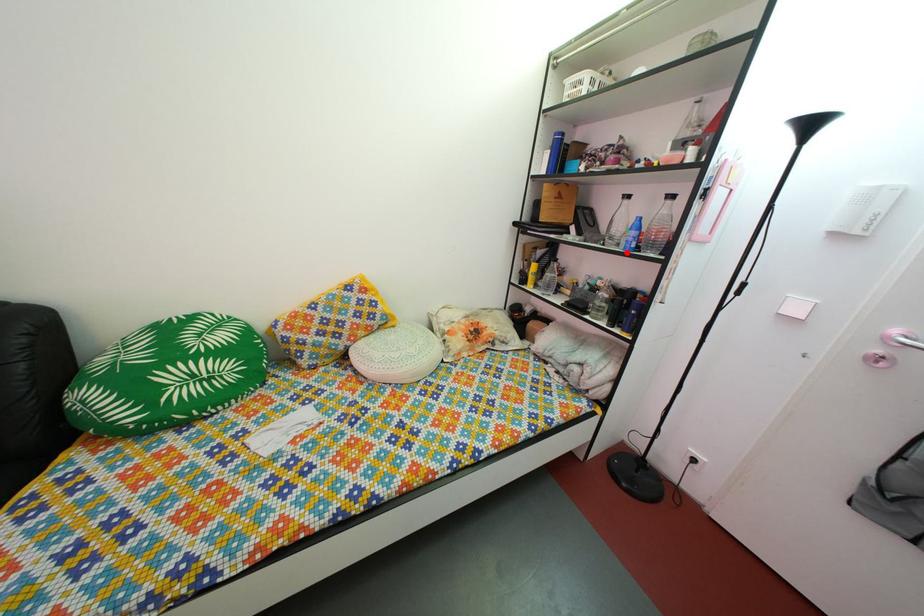
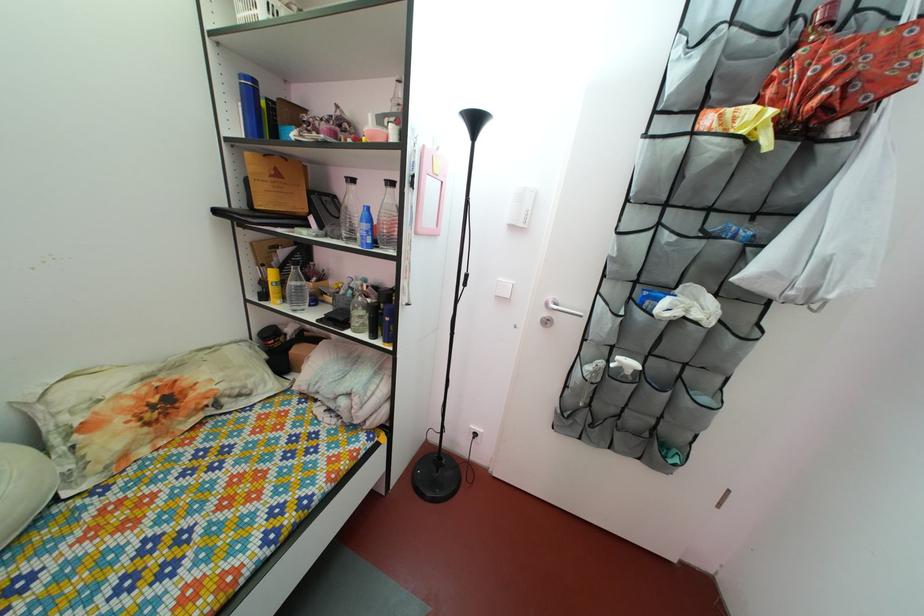
Question: A red point is marked in image1. In image2, is the corresponding 3D point closer to the camera or farther? Reply with the corresponding letter.

Choices:
 (A) The corresponding 3D point is closer.
 (B) The corresponding 3D point is farther.

Answer: (B)